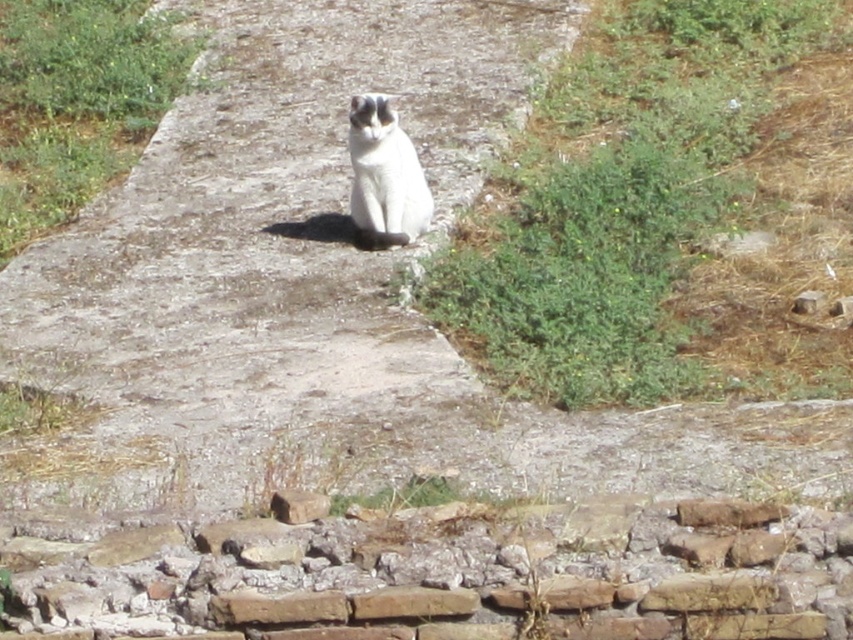
Question: Is rusty brick wall at lower center positioned at the back of white fur cat at center?

Choices:
 (A) no
 (B) yes

Answer: (A)

Question: Among these points, which one is nearest to the camera?

Choices:
 (A) (566, 568)
 (B) (419, 225)

Answer: (A)

Question: Does rusty brick wall at lower center appear over white fur cat at center?

Choices:
 (A) yes
 (B) no

Answer: (B)

Question: Considering the relative positions of rusty brick wall at lower center and white fur cat at center in the image provided, where is rusty brick wall at lower center located with respect to white fur cat at center?

Choices:
 (A) left
 (B) right

Answer: (B)

Question: Which object is farther from the camera taking this photo?

Choices:
 (A) rusty brick wall at lower center
 (B) white fur cat at center

Answer: (B)